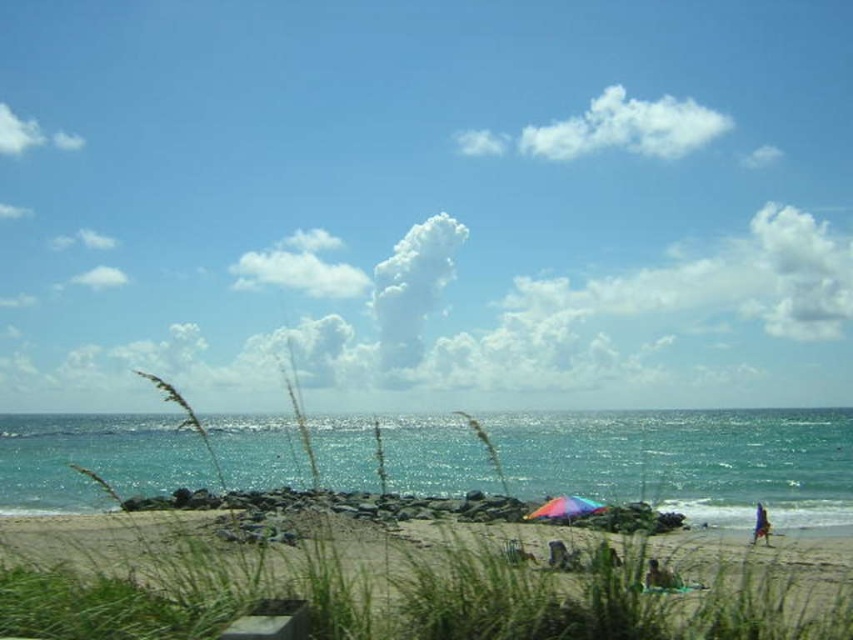
You are planning to set up a picnic area on the beach and have both a rainbow fabric umbrella at lower center and a blue fabric umbrella at lower right. Which umbrella should you choose if you want the one that provides a wider shade area?

The rainbow fabric umbrella at lower center should be chosen because its width is larger than the blue fabric umbrella at lower right, providing a wider shade area.